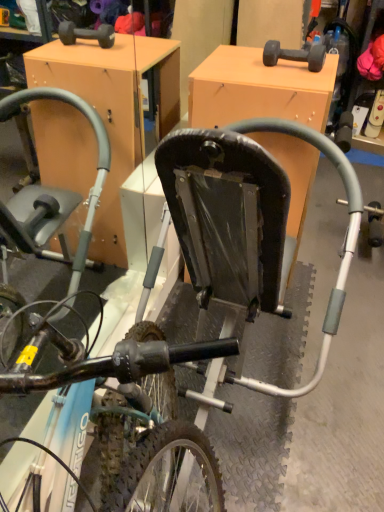
Describe the element at coordinates (102, 395) in the screenshot. I see `metallic silver bicycle at center` at that location.

This screenshot has height=512, width=384. What are the coordinates of `metallic silver bicycle at center` in the screenshot? It's located at (102, 395).

What do you see at coordinates (258, 89) in the screenshot? I see `matte orange cabinet at center` at bounding box center [258, 89].

Looking at this image, what is the approximate height of matte orange cabinet at center?

matte orange cabinet at center is 35.80 inches tall.

The width and height of the screenshot is (384, 512). Identify the location of matte orange cabinet at center. (258, 89).

Where is `metallic silver bicycle at center`? The image size is (384, 512). metallic silver bicycle at center is located at coordinates (102, 395).

Would you say metallic silver bicycle at center is to the left or to the right of matte orange cabinet at center in the picture?

Clearly, metallic silver bicycle at center is on the left of matte orange cabinet at center in the image.

Which is in front, metallic silver bicycle at center or matte orange cabinet at center?

metallic silver bicycle at center.

Between point (170, 421) and point (186, 278), which one is positioned behind?

The point (186, 278) is farther.

From the image's perspective, is metallic silver bicycle at center positioned above or below matte orange cabinet at center?

From the image's perspective, metallic silver bicycle at center appears above matte orange cabinet at center.

Based on the photo, from a real-world perspective, between metallic silver bicycle at center and matte orange cabinet at center, who is vertically higher?

metallic silver bicycle at center is physically above.

Considering the sizes of metallic silver bicycle at center and matte orange cabinet at center in the image, is metallic silver bicycle at center wider or thinner than matte orange cabinet at center?

In the image, metallic silver bicycle at center appears to be more narrow than matte orange cabinet at center.

Between metallic silver bicycle at center and matte orange cabinet at center, which one has less height?

matte orange cabinet at center.

Is metallic silver bicycle at center bigger or smaller than matte orange cabinet at center?

metallic silver bicycle at center is smaller than matte orange cabinet at center.

Can matte orange cabinet at center be found inside metallic silver bicycle at center?

Actually, matte orange cabinet at center is outside metallic silver bicycle at center.

Would you say metallic silver bicycle at center is a long distance from matte orange cabinet at center?

That's not correct — metallic silver bicycle at center is a little close to matte orange cabinet at center.

Is metallic silver bicycle at center oriented towards matte orange cabinet at center?

Yes, metallic silver bicycle at center faces towards matte orange cabinet at center.

In the scene shown: Can you tell me how much metallic silver bicycle at center and matte orange cabinet at center differ in facing direction?

The angle between the facing direction of metallic silver bicycle at center and the facing direction of matte orange cabinet at center is 0.664 degrees.

This screenshot has height=512, width=384. In order to click on table below the metallic silver bicycle at center (from the image's perspective) in this screenshot , I will do coord(258,89).

Can you confirm if matte orange cabinet at center is positioned to the right of metallic silver bicycle at center?

Yes, matte orange cabinet at center is to the right of metallic silver bicycle at center.

Between matte orange cabinet at center and metallic silver bicycle at center, which one is positioned in front?

Positioned in front is metallic silver bicycle at center.

Between point (318, 116) and point (135, 490), which one is positioned in front?

The point (135, 490) is closer.

From the image's perspective, relative to metallic silver bicycle at center, is matte orange cabinet at center above or below?

Clearly, from the image's perspective, matte orange cabinet at center is below metallic silver bicycle at center.

From a real-world perspective, who is located lower, matte orange cabinet at center or metallic silver bicycle at center?

In real-world perspective, matte orange cabinet at center is lower.

Looking at their sizes, would you say matte orange cabinet at center is wider or thinner than metallic silver bicycle at center?

Considering their sizes, matte orange cabinet at center looks broader than metallic silver bicycle at center.

Is matte orange cabinet at center shorter than metallic silver bicycle at center?

Yes, matte orange cabinet at center is shorter than metallic silver bicycle at center.

Can you confirm if matte orange cabinet at center is smaller than metallic silver bicycle at center?

No, matte orange cabinet at center is not smaller than metallic silver bicycle at center.

Can metallic silver bicycle at center be found inside matte orange cabinet at center?

No, metallic silver bicycle at center is not inside matte orange cabinet at center.

Is matte orange cabinet at center touching metallic silver bicycle at center?

No, matte orange cabinet at center is not making contact with metallic silver bicycle at center.

Is matte orange cabinet at center oriented away from metallic silver bicycle at center?

Yes.

Can you tell me how much matte orange cabinet at center and metallic silver bicycle at center differ in facing direction?

matte orange cabinet at center and metallic silver bicycle at center are facing 0.664 degrees away from each other.

Measure the distance between matte orange cabinet at center and metallic silver bicycle at center.

matte orange cabinet at center is 27.27 inches from metallic silver bicycle at center.

Where is `table below the metallic silver bicycle at center (from the image's perspective)`? table below the metallic silver bicycle at center (from the image's perspective) is located at coordinates (258, 89).

This screenshot has width=384, height=512. I want to click on bicycle to the left of matte orange cabinet at center, so click(102, 395).

The image size is (384, 512). In order to click on table that is under the metallic silver bicycle at center (from a real-world perspective) in this screenshot , I will do `click(258, 89)`.